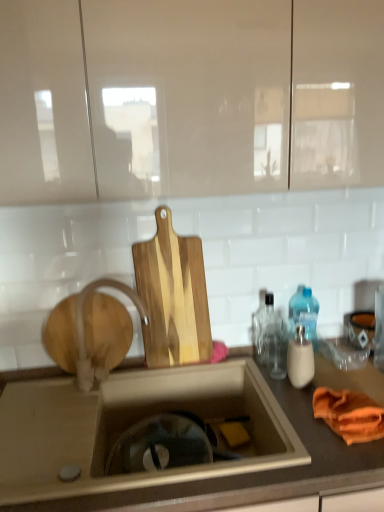
Locate an element on the screen. This screenshot has width=384, height=512. free space in front of translucent glass bottle at right, positioned as the third bottle in back-to-front order is located at coordinates [x=299, y=416].